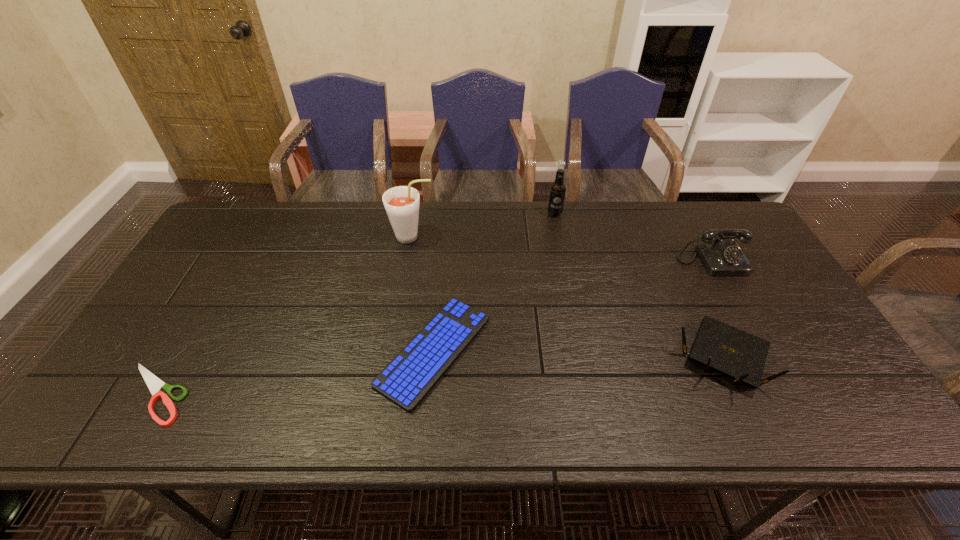
Identify the location of the fourth object from left to right. (558, 188).

The image size is (960, 540). I want to click on the farther root beer, so click(558, 188).

Find the location of a particular element. the left root beer is located at coordinates (401, 203).

I want to click on telephone, so click(x=721, y=256).

At what (x,y) coordinates should I click in order to perform the action: click on router. Please return your answer as a coordinate pair (x, y). Looking at the image, I should click on (734, 353).

You are a GUI agent. You are given a task and a screenshot of the screen. Output one action in this format:
    pyautogui.click(x=<x>, y=<y>)
    Task: Click on the fifth tallest object
    This screenshot has width=960, height=540.
    Given the screenshot: What is the action you would take?
    pyautogui.click(x=416, y=369)

Identify the location of scissors. (154, 384).

Find the location of a particular element. This screenshot has width=960, height=540. the shortest object is located at coordinates (154, 384).

In order to click on vacant space located 0.280m on the label of the right root beer in this screenshot , I will do `click(567, 278)`.

Identify the location of free region located 0.300m on the drink side of the left root beer. (528, 237).